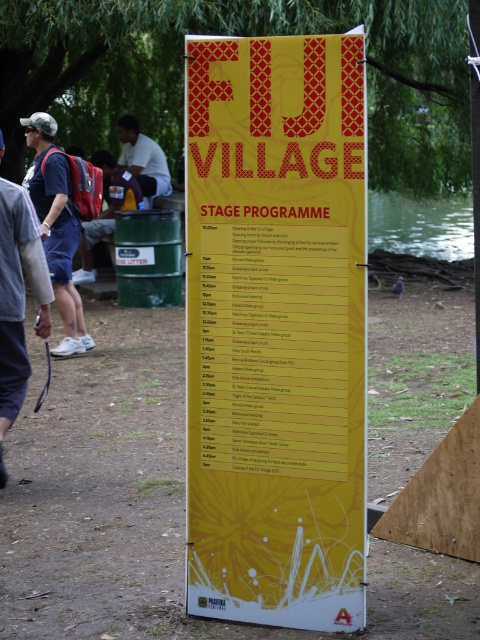
You are attending an outdoor event and see two people wearing the matte blue shirt at left and the white matte shirt at upper center. Which person is standing closer to the ground?

The matte blue shirt at left is below the white matte shirt at upper center, so the person wearing the matte blue shirt at left is standing closer to the ground.